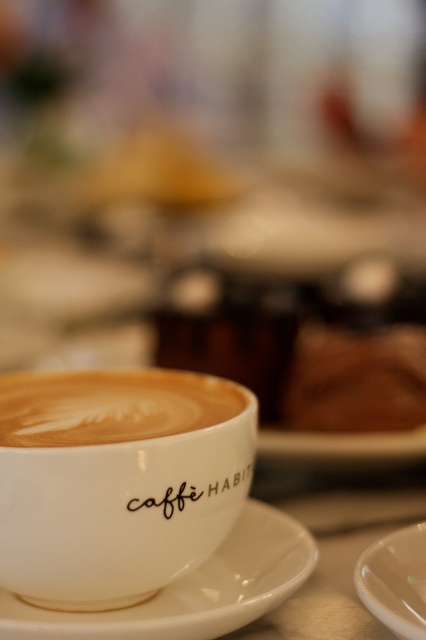
Question: Can you confirm if white ceramic saucer at center is positioned below black matte text at center?

Choices:
 (A) yes
 (B) no

Answer: (A)

Question: Does latte art at center have a smaller size compared to black matte text at center?

Choices:
 (A) yes
 (B) no

Answer: (B)

Question: Which object is positioned closest to the latte art at center?

Choices:
 (A) white ceramic saucer at center
 (B) white matte cup at center
 (C) black matte text at center
 (D) white glossy plate at lower right

Answer: (B)

Question: Which of the following is the closest to the observer?

Choices:
 (A) white ceramic saucer at center
 (B) black matte text at center
 (C) latte art at center

Answer: (A)

Question: Can you confirm if white matte cup at center is positioned to the left of white glossy plate at lower right?

Choices:
 (A) no
 (B) yes

Answer: (B)

Question: Which object appears closest to the camera in this image?

Choices:
 (A) latte art at center
 (B) white ceramic saucer at center
 (C) white matte cup at center

Answer: (B)